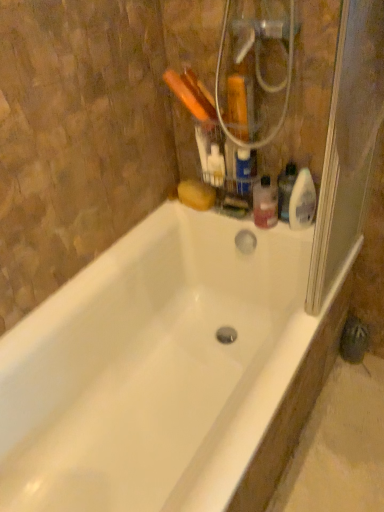
Question: From a real-world perspective, is translucent plastic bottle at upper right, the second cleaning product from the right, located beneath translucent plastic bottle at upper right?

Choices:
 (A) no
 (B) yes

Answer: (A)

Question: Could you tell me if translucent plastic bottle at upper right, arranged as the second cleaning product when viewed from the left, is turned towards translucent plastic bottle at upper right?

Choices:
 (A) no
 (B) yes

Answer: (A)

Question: From the image's perspective, is translucent plastic bottle at upper right, the second cleaning product from the right, above translucent plastic bottle at upper right?

Choices:
 (A) no
 (B) yes

Answer: (B)

Question: Is translucent plastic bottle at upper right, the second cleaning product from the right, directly adjacent to translucent plastic bottle at upper right?

Choices:
 (A) no
 (B) yes

Answer: (B)

Question: Is translucent plastic bottle at upper right, the second cleaning product from the right, to the left of translucent plastic bottle at upper right from the viewer's perspective?

Choices:
 (A) yes
 (B) no

Answer: (B)

Question: From the image's perspective, is translucent plastic spray bottle at upper right, the 3th cleaning product in the left-to-right sequence, above or below transparent plastic screen door at right?

Choices:
 (A) above
 (B) below

Answer: (B)

Question: Is translucent plastic spray bottle at upper right, the 3th cleaning product in the left-to-right sequence, bigger or smaller than transparent plastic screen door at right?

Choices:
 (A) small
 (B) big

Answer: (A)

Question: Is translucent plastic spray bottle at upper right, the 1th cleaning product positioned from the right, situated inside transparent plastic screen door at right or outside?

Choices:
 (A) inside
 (B) outside

Answer: (B)

Question: Is point coord(304,192) closer or farther from the camera than point coord(357,104)?

Choices:
 (A) closer
 (B) farther

Answer: (B)

Question: From a real-world perspective, is translucent plastic spray bottle at upper right, the 3th cleaning product in the left-to-right sequence, physically located above or below white glossy bathtub at center?

Choices:
 (A) above
 (B) below

Answer: (A)

Question: In the image, is translucent plastic spray bottle at upper right, the 1th cleaning product positioned from the right, positioned in front of or behind white glossy bathtub at center?

Choices:
 (A) behind
 (B) front

Answer: (A)

Question: In terms of size, does translucent plastic spray bottle at upper right, the 3th cleaning product in the left-to-right sequence, appear bigger or smaller than white glossy bathtub at center?

Choices:
 (A) big
 (B) small

Answer: (B)

Question: In terms of width, does translucent plastic spray bottle at upper right, the 3th cleaning product in the left-to-right sequence, look wider or thinner when compared to white glossy bathtub at center?

Choices:
 (A) thin
 (B) wide

Answer: (A)

Question: From a real-world perspective, relative to translucent plastic bottle at upper right, is transparent plastic screen door at right vertically above or below?

Choices:
 (A) below
 (B) above

Answer: (B)

Question: In terms of width, does transparent plastic screen door at right look wider or thinner when compared to translucent plastic bottle at upper right?

Choices:
 (A) thin
 (B) wide

Answer: (A)